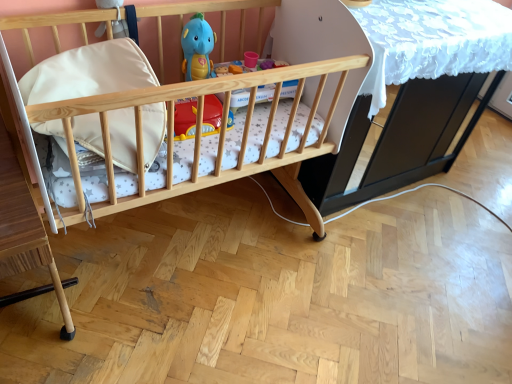
Locate an element on the screen. This screenshot has height=384, width=512. vacant location below natural wood crib at center (from a real-world perspective) is located at coordinates (177, 238).